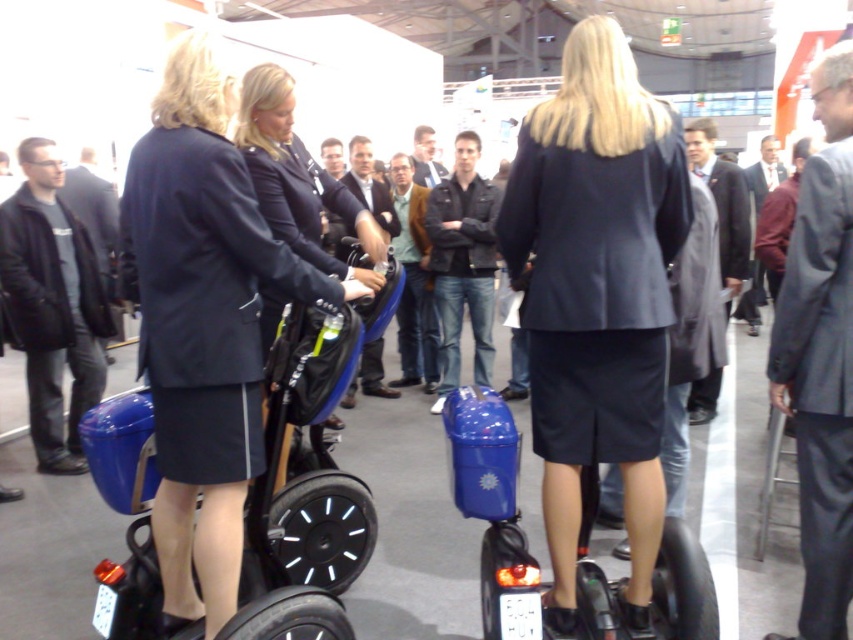
Which is below, matte black suit at center or dark gray suit at right?

dark gray suit at right is lower down.

Who is taller, matte black suit at center or dark gray suit at right?

Standing taller between the two is matte black suit at center.

Between point (633, 451) and point (840, 586), which one is positioned in front?

Point (633, 451) is in front.

Locate an element on the screen. matte black suit at center is located at coordinates (596, 296).

Is matte black segway at center above gray wool coat at center?

Actually, matte black segway at center is below gray wool coat at center.

Which is more to the right, matte black segway at center or gray wool coat at center?

gray wool coat at center

Is point (169, 563) behind point (703, 380)?

No, it is in front of (703, 380).

Where is `matte black segway at center`? The height and width of the screenshot is (640, 853). matte black segway at center is located at coordinates (199, 548).

Does matte black suit at center have a smaller size compared to matte black jacket at center?

Actually, matte black suit at center might be larger than matte black jacket at center.

Consider the image. Is matte black suit at center in front of matte black jacket at center?

That is True.

I want to click on matte black suit at center, so click(596, 296).

You are a GUI agent. You are given a task and a screenshot of the screen. Output one action in this format:
    pyautogui.click(x=<x>, y=<y>)
    Task: Click on the matte black suit at center
    
    Given the screenshot: What is the action you would take?
    pyautogui.click(x=596, y=296)